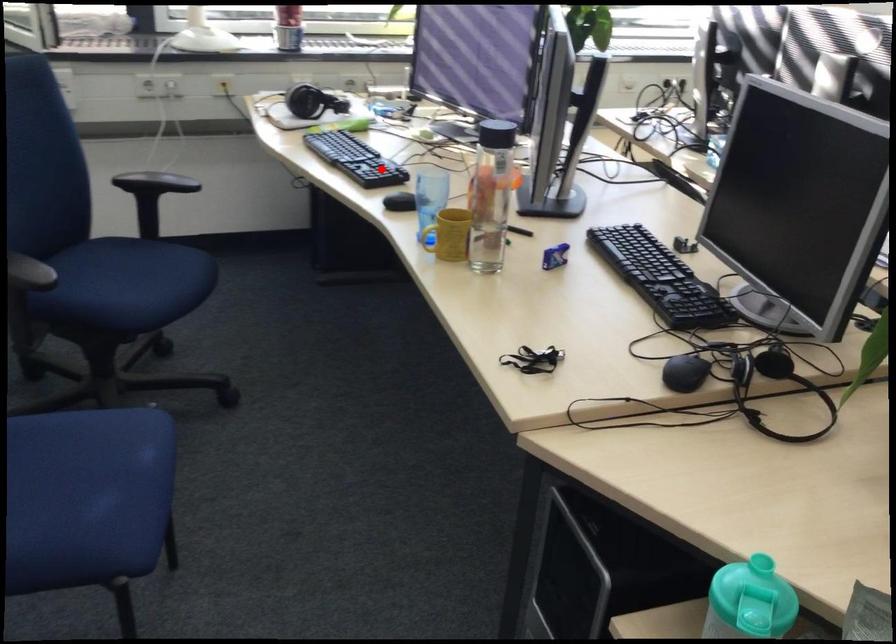
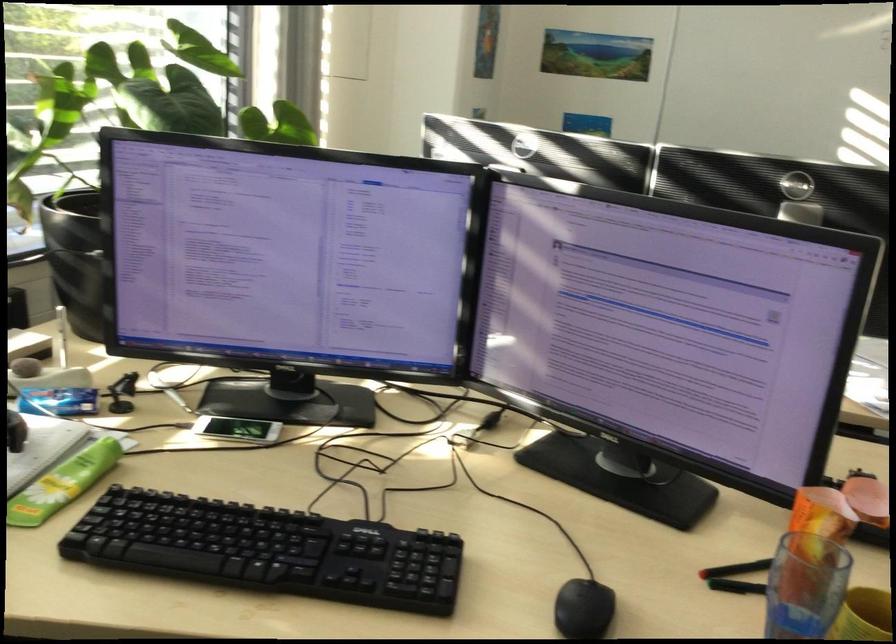
Question: I am providing you with two images of the same scene from different viewpoints. A red point is shown in image1. For the corresponding object point in image2, is it positioned nearer or farther from the camera?

Choices:
 (A) Nearer
 (B) Farther

Answer: (A)